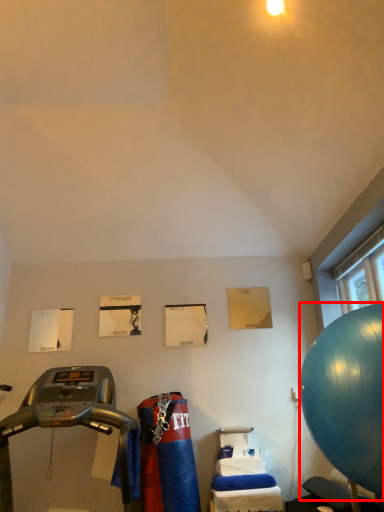
Question: From the image, what is the correct spatial relationship of ball (annotated by the red box) in relation to treadmill?

Choices:
 (A) right
 (B) left

Answer: (A)